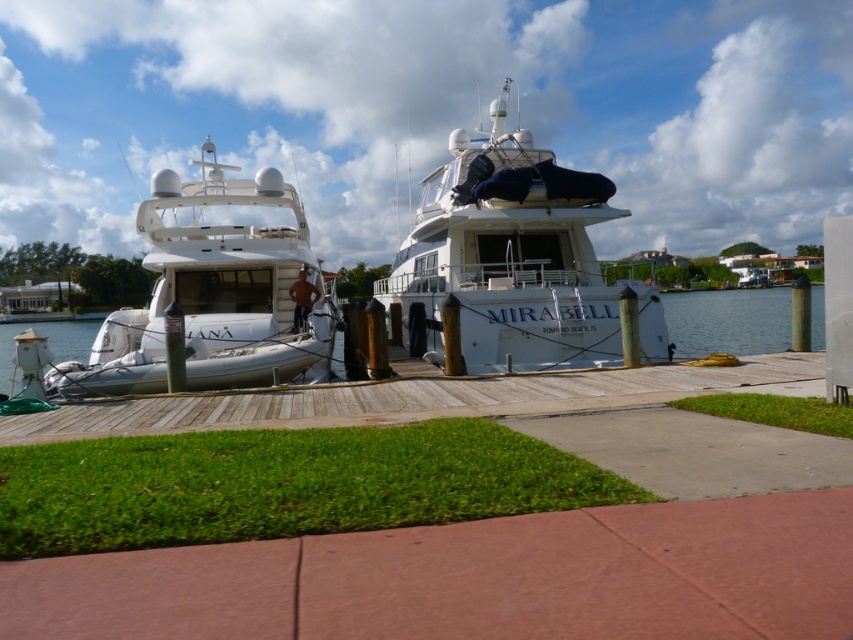
Question: From the image, what is the correct spatial relationship of white glossy boat at center in relation to white glossy yacht at center?

Choices:
 (A) right
 (B) left

Answer: (A)

Question: Is white glossy yacht at center thinner than wooden dock at center?

Choices:
 (A) no
 (B) yes

Answer: (A)

Question: Which object appears farthest from the camera in this image?

Choices:
 (A) wooden dock at center
 (B) white glossy yacht at center
 (C) white glossy boat at center

Answer: (C)

Question: Estimate the real-world distances between objects in this image. Which object is farther from the white glossy boat at center?

Choices:
 (A) wooden dock at center
 (B) white glossy yacht at center

Answer: (A)

Question: Which of the following is the closest to the observer?

Choices:
 (A) white glossy yacht at center
 (B) wooden dock at center
 (C) white glossy boat at center

Answer: (B)

Question: Can you confirm if white glossy yacht at center is thinner than wooden dock at center?

Choices:
 (A) no
 (B) yes

Answer: (A)